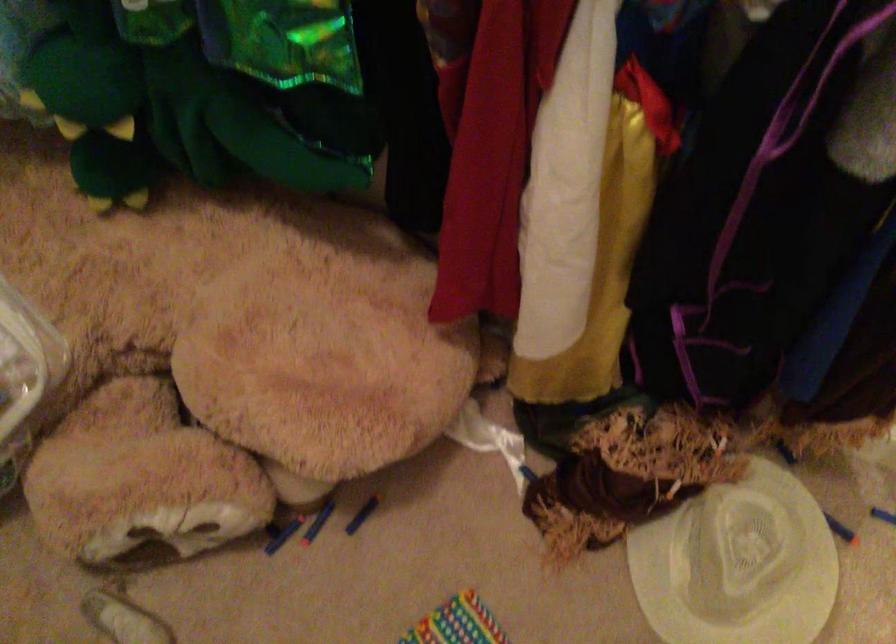
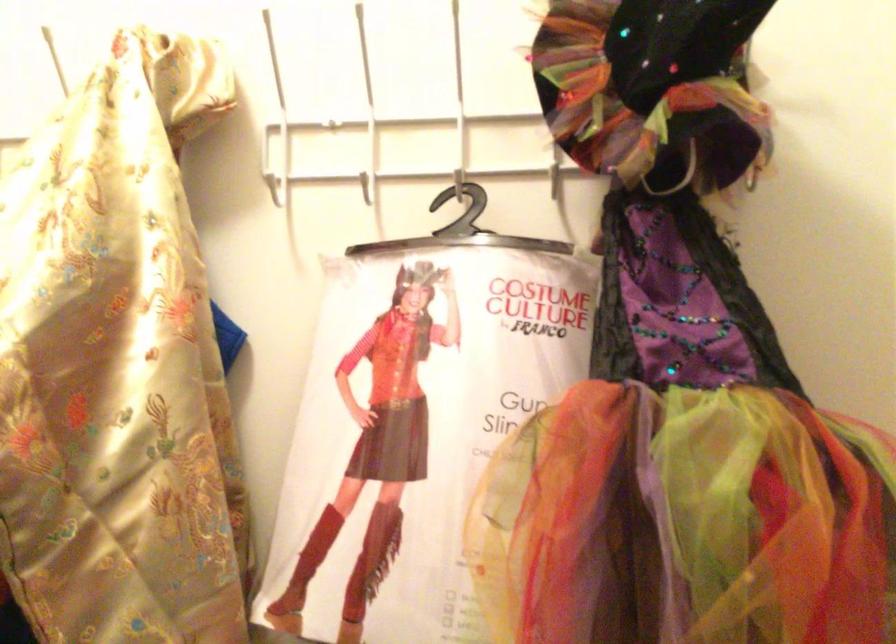
How did the camera likely rotate?

The rotation direction of the camera is right-up.